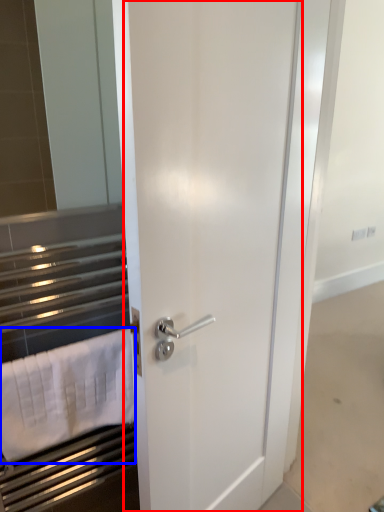
Question: Among these objects, which one is nearest to the camera, door (highlighted by a red box) or bath towel (highlighted by a blue box)?

Choices:
 (A) door
 (B) bath towel

Answer: (A)